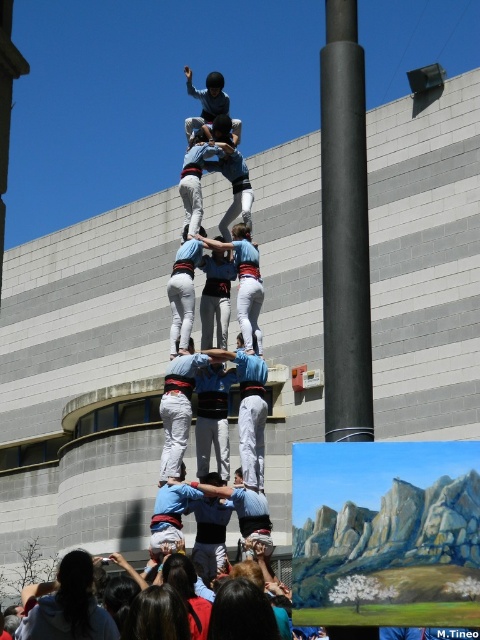
Does point (168, 440) lie in front of point (208, 93)?

Yes.

Which of these two, white cotton pants at center or light blue fabric shirt at center, stands taller?

light blue fabric shirt at center

Image resolution: width=480 pixels, height=640 pixels. Identify the location of white cotton pants at center. (178, 408).

Where is `white cotton pants at center`? This screenshot has height=640, width=480. white cotton pants at center is located at coordinates (178, 408).

Is point (344, 380) positioned in front of point (200, 186)?

Yes.

Who is positioned more to the left, black smooth pole at center or light blue fabric at center?

From the viewer's perspective, light blue fabric at center appears more on the left side.

Where is `black smooth pole at center`? This screenshot has height=640, width=480. black smooth pole at center is located at coordinates (345, 228).

Is point (324, 54) less distant than point (193, 116)?

Yes, point (324, 54) is in front of point (193, 116).

Who is taller, black smooth pole at center or light blue fabric shirt at center?

With more height is light blue fabric shirt at center.

Is point (352, 404) behind point (184, 67)?

No, (352, 404) is closer to viewer.

You are a GUI agent. You are given a task and a screenshot of the screen. Output one action in this format:
    pyautogui.click(x=<x>, y=<y>)
    Task: Click on the black smooth pole at center
    
    Given the screenshot: What is the action you would take?
    pyautogui.click(x=345, y=228)